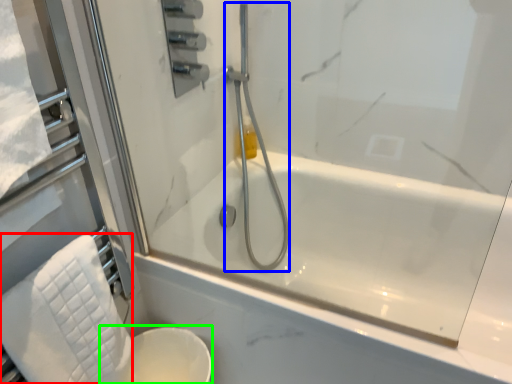
Question: Which object is positioned closest to bath towel (highlighted by a red box)? Select from shower (highlighted by a blue box) and toilet bowl (highlighted by a green box).

Choices:
 (A) shower
 (B) toilet bowl

Answer: (B)